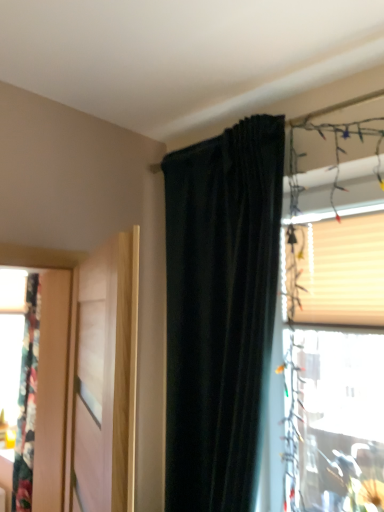
Question: Is translucent plastic window at upper right shorter than beige textured blind at upper right?

Choices:
 (A) yes
 (B) no

Answer: (B)

Question: Is translucent plastic window at upper right at the right side of beige textured blind at upper right?

Choices:
 (A) no
 (B) yes

Answer: (A)

Question: Is translucent plastic window at upper right taller than beige textured blind at upper right?

Choices:
 (A) no
 (B) yes

Answer: (B)

Question: Are translucent plastic window at upper right and beige textured blind at upper right beside each other?

Choices:
 (A) no
 (B) yes

Answer: (A)

Question: Is there a large distance between translucent plastic window at upper right and beige textured blind at upper right?

Choices:
 (A) yes
 (B) no

Answer: (B)

Question: From the image's perspective, is translucent plastic window at upper right located beneath beige textured blind at upper right?

Choices:
 (A) no
 (B) yes

Answer: (B)

Question: Is translucent plastic window at upper right far away from dark velvet curtain at upper center?

Choices:
 (A) yes
 (B) no

Answer: (B)

Question: Does translucent plastic window at upper right have a lesser height compared to dark velvet curtain at upper center?

Choices:
 (A) yes
 (B) no

Answer: (A)

Question: Considering the relative positions of translucent plastic window at upper right and dark velvet curtain at upper center in the image provided, is translucent plastic window at upper right to the right of dark velvet curtain at upper center from the viewer's perspective?

Choices:
 (A) no
 (B) yes

Answer: (B)

Question: Is translucent plastic window at upper right positioned with its back to dark velvet curtain at upper center?

Choices:
 (A) yes
 (B) no

Answer: (B)

Question: From the image's perspective, is translucent plastic window at upper right on dark velvet curtain at upper center?

Choices:
 (A) no
 (B) yes

Answer: (B)

Question: Is translucent plastic window at upper right placed right next to dark velvet curtain at upper center?

Choices:
 (A) yes
 (B) no

Answer: (B)

Question: Is beige textured blind at upper right in contact with dark velvet curtain at upper center?

Choices:
 (A) no
 (B) yes

Answer: (A)